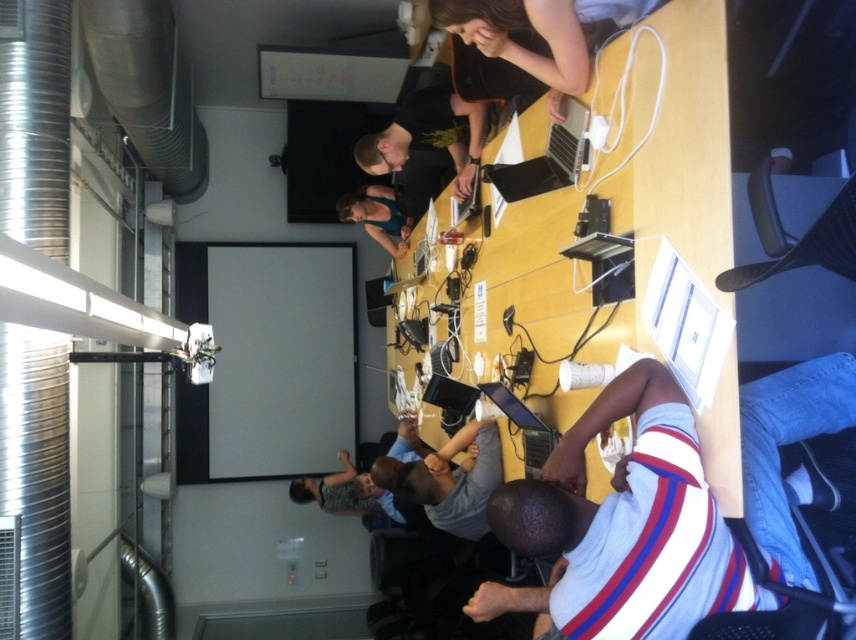
You are organizing a small workshop and need to place a new notebook on the table. The notebook is the same size as the black matte shirt at upper center. Can the notebook fit in the space currently taken by the matte black laptop at upper center?

The matte black laptop at upper center occupies less space than the black matte shirt at upper center. Since the notebook is the same size as the black matte shirt at upper center, it will not fit in the space currently occupied by the matte black laptop at upper center because the laptop takes up less area.

Looking at the scene, where is the gray fabric shirt at center in relation to the black matte shirt at upper center?

The gray fabric shirt at center is to the left of the black matte shirt at upper center.